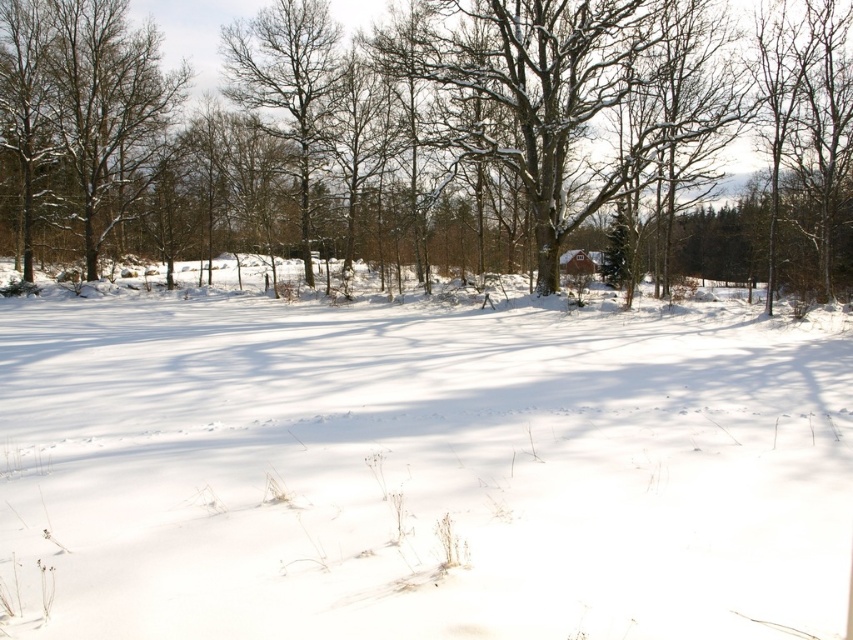
Locate an element on the screen. Image resolution: width=853 pixels, height=640 pixels. white fluffy snow at center is located at coordinates (421, 468).

Is point (498, 481) less distant than point (33, 104)?

Yes, it is.

Is point (677, 536) closer to camera compared to point (9, 54)?

Yes, point (677, 536) is in front of point (9, 54).

I want to click on white fluffy snow at center, so click(421, 468).

Is snow-covered tree at center wider than bare wood tree at center?

Indeed, snow-covered tree at center has a greater width compared to bare wood tree at center.

Does snow-covered tree at center appear under bare wood tree at center?

Yes.

In order to click on snow-covered tree at center in this screenshot , I will do `click(432, 136)`.

You are a GUI agent. You are given a task and a screenshot of the screen. Output one action in this format:
    pyautogui.click(x=<x>, y=<y>)
    Task: Click on the snow-covered tree at center
    This screenshot has height=640, width=853.
    Given the screenshot: What is the action you would take?
    pyautogui.click(x=432, y=136)

Who is positioned more to the left, white fluffy snow at center or bare wood tree at center?

Positioned to the left is bare wood tree at center.

This screenshot has width=853, height=640. What are the coordinates of `white fluffy snow at center` in the screenshot? It's located at (421, 468).

Locate an element on the screen. Image resolution: width=853 pixels, height=640 pixels. white fluffy snow at center is located at coordinates (421, 468).